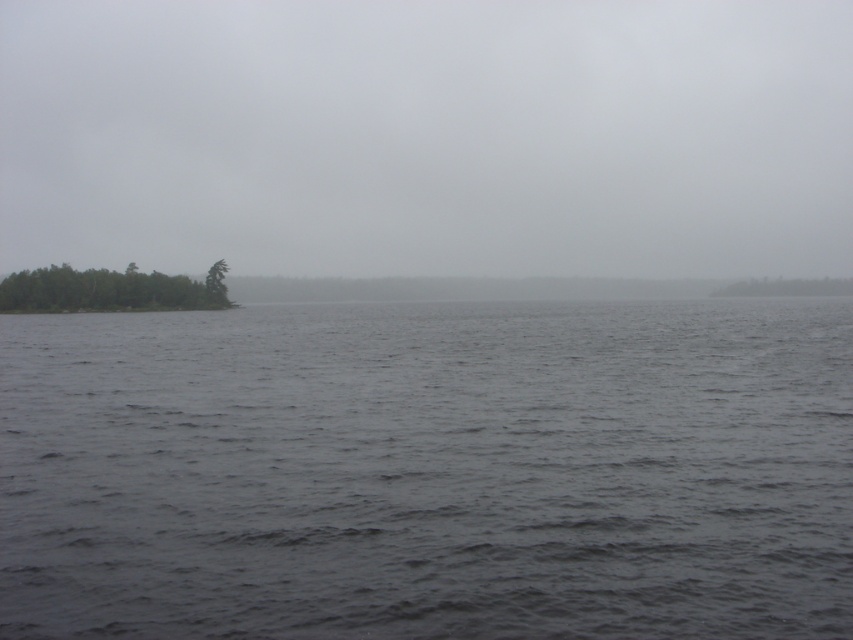
Is point (624, 324) closer to camera compared to point (840, 284)?

Yes, point (624, 324) is closer to viewer.

Which is above, dark gray water at center or green matte tree at right?

green matte tree at right

Is point (99, 625) closer to viewer compared to point (781, 282)?

Yes, point (99, 625) is closer to viewer.

This screenshot has height=640, width=853. What are the coordinates of `dark gray water at center` in the screenshot? It's located at (428, 470).

Is dark gray water at center further to camera compared to gray cloudy sky at upper center?

No.

Who is more forward, (618, 570) or (721, 49)?

Point (618, 570) is in front.

Does point (704, 396) come behind point (616, 131)?

No, it is not.

This screenshot has height=640, width=853. Find the location of `dark gray water at center`. dark gray water at center is located at coordinates (428, 470).

Does gray cloudy sky at upper center have a larger size compared to green matte tree at center?

Yes.

Who is taller, gray cloudy sky at upper center or green matte tree at center?

Standing taller between the two is gray cloudy sky at upper center.

Identify the location of gray cloudy sky at upper center. (428, 138).